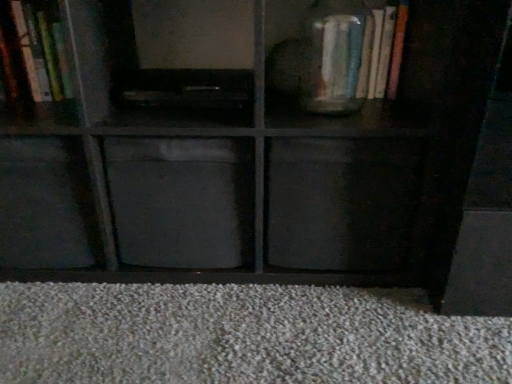
Question: From a real-world perspective, does matte black cube at lower left, marked as the 2th cabinet in a left-to-right arrangement, stand above matte gray cabinet at center, which is the third cabinet in left-to-right order?

Choices:
 (A) yes
 (B) no

Answer: (A)

Question: Is matte black cube at lower left, positioned as the second cabinet in right-to-left order, located outside matte gray cabinet at center, which is the third cabinet in left-to-right order?

Choices:
 (A) yes
 (B) no

Answer: (A)

Question: Does matte black cube at lower left, positioned as the second cabinet in right-to-left order, have a greater width compared to matte gray cabinet at center, positioned as the first cabinet in right-to-left order?

Choices:
 (A) yes
 (B) no

Answer: (A)

Question: Is matte black cube at lower left, marked as the 2th cabinet in a left-to-right arrangement, facing away from matte gray cabinet at center, which is the third cabinet in left-to-right order?

Choices:
 (A) no
 (B) yes

Answer: (A)

Question: Does matte black cube at lower left, positioned as the second cabinet in right-to-left order, lie behind matte gray cabinet at center, positioned as the first cabinet in right-to-left order?

Choices:
 (A) no
 (B) yes

Answer: (B)

Question: Is matte black cube at lower left, marked as the 2th cabinet in a left-to-right arrangement, smaller than matte gray cabinet at center, which is the third cabinet in left-to-right order?

Choices:
 (A) no
 (B) yes

Answer: (A)

Question: From the image's perspective, is wooden bookshelf at upper left, acting as the 3th cabinet starting from the right, above matte glass vase at upper right?

Choices:
 (A) yes
 (B) no

Answer: (B)

Question: Can you confirm if wooden bookshelf at upper left, acting as the 3th cabinet starting from the right, is bigger than matte glass vase at upper right?

Choices:
 (A) yes
 (B) no

Answer: (A)

Question: Is wooden bookshelf at upper left, acting as the first cabinet starting from the left, positioned before matte glass vase at upper right?

Choices:
 (A) yes
 (B) no

Answer: (A)

Question: Considering the relative sizes of wooden bookshelf at upper left, acting as the 3th cabinet starting from the right, and matte glass vase at upper right in the image provided, is wooden bookshelf at upper left, acting as the 3th cabinet starting from the right, thinner than matte glass vase at upper right?

Choices:
 (A) no
 (B) yes

Answer: (A)

Question: Considering the relative sizes of wooden bookshelf at upper left, acting as the first cabinet starting from the left, and matte glass vase at upper right in the image provided, is wooden bookshelf at upper left, acting as the first cabinet starting from the left, wider than matte glass vase at upper right?

Choices:
 (A) yes
 (B) no

Answer: (A)

Question: Would you say matte glass vase at upper right is part of wooden bookshelf at upper left, acting as the first cabinet starting from the left,'s contents?

Choices:
 (A) yes
 (B) no

Answer: (B)

Question: Is black matte drawer at center at the left side of matte gray cabinet at center, which is the third cabinet in left-to-right order?

Choices:
 (A) yes
 (B) no

Answer: (B)